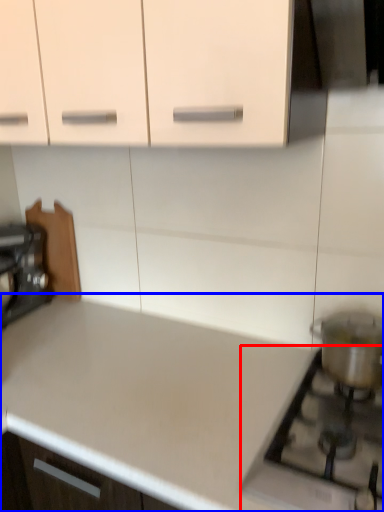
Question: Which object is further to the camera taking this photo, gas stove (highlighted by a red box) or countertop (highlighted by a blue box)?

Choices:
 (A) gas stove
 (B) countertop

Answer: (A)